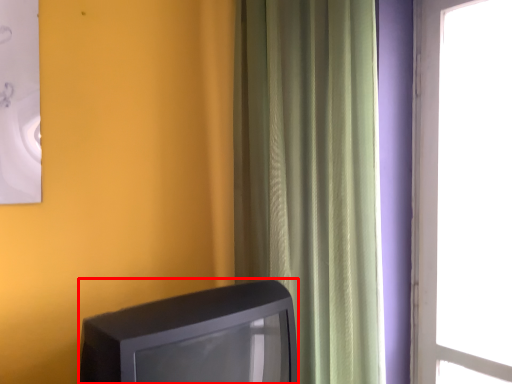
Question: From the image's perspective, what is the correct spatial positioning of television (annotated by the red box) in reference to curtain?

Choices:
 (A) above
 (B) below

Answer: (B)